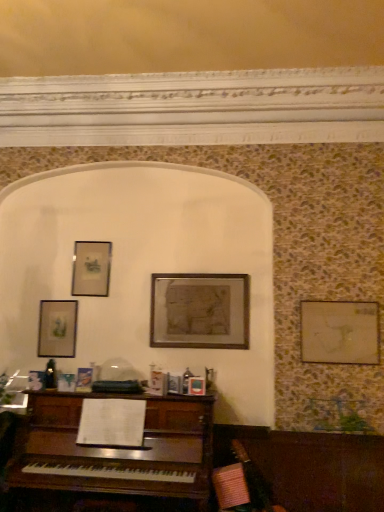
Image resolution: width=384 pixels, height=512 pixels. What do you see at coordinates (340, 332) in the screenshot? I see `wooden picture frame at right, which is counted as the 1th picture frame, starting from the right` at bounding box center [340, 332].

This screenshot has height=512, width=384. What do you see at coordinates (57, 328) in the screenshot? I see `matte glass picture frame at upper left, arranged as the 1th picture frame when viewed from the left` at bounding box center [57, 328].

Identify the location of wooden picture frame at right, which is the 4th picture frame from left to right. This screenshot has width=384, height=512. (340, 332).

Would you say matte glass picture frame at upper left, arranged as the 1th picture frame when viewed from the left, is a long distance from wooden framed map at center, which is counted as the 3th picture frame, starting from the left?

Actually, matte glass picture frame at upper left, arranged as the 1th picture frame when viewed from the left, and wooden framed map at center, which is counted as the 3th picture frame, starting from the left, are a little close together.

Find the location of a particular element. The height and width of the screenshot is (512, 384). picture frame that is the 2nd object to the left of the wooden framed map at center, the 2th picture frame from the right, starting at the anchor is located at coordinates (57, 328).

From the picture: Considering the sizes of objects matte glass picture frame at upper left, which ranks as the 4th picture frame in right-to-left order, and wooden framed map at center, which is counted as the 3th picture frame, starting from the left, in the image provided, who is wider, matte glass picture frame at upper left, which ranks as the 4th picture frame in right-to-left order, or wooden framed map at center, which is counted as the 3th picture frame, starting from the left,?

With larger width is wooden framed map at center, which is counted as the 3th picture frame, starting from the left.

Could you tell me if matte glass picture frame at upper left, arranged as the 1th picture frame when viewed from the left, is facing wooden framed map at center, which is counted as the 3th picture frame, starting from the left?

No, matte glass picture frame at upper left, arranged as the 1th picture frame when viewed from the left, is not turned towards wooden framed map at center, which is counted as the 3th picture frame, starting from the left.

Consider the image. Are wooden picture frame at right, which is the 4th picture frame from left to right, and matte glass picture frame at upper left, arranged as the 1th picture frame when viewed from the left, making contact?

No, wooden picture frame at right, which is the 4th picture frame from left to right, is not beside matte glass picture frame at upper left, arranged as the 1th picture frame when viewed from the left.

Is wooden picture frame at right, which is counted as the 1th picture frame, starting from the right, at the left side of matte glass picture frame at upper left, arranged as the 1th picture frame when viewed from the left?

Incorrect, wooden picture frame at right, which is counted as the 1th picture frame, starting from the right, is not on the left side of matte glass picture frame at upper left, arranged as the 1th picture frame when viewed from the left.

From the image's perspective, is wooden picture frame at right, which is counted as the 1th picture frame, starting from the right, over matte glass picture frame at upper left, which ranks as the 4th picture frame in right-to-left order?

Yes, from the image's perspective, wooden picture frame at right, which is counted as the 1th picture frame, starting from the right, is over matte glass picture frame at upper left, which ranks as the 4th picture frame in right-to-left order.

Considering the positions of objects wooden picture frame at right, which is counted as the 1th picture frame, starting from the right, and matte glass picture frame at upper left, which ranks as the 4th picture frame in right-to-left order, in the image provided, who is behind, wooden picture frame at right, which is counted as the 1th picture frame, starting from the right, or matte glass picture frame at upper left, which ranks as the 4th picture frame in right-to-left order,?

matte glass picture frame at upper left, which ranks as the 4th picture frame in right-to-left order, is more distant.

Does matte silver picture frame at upper left, placed as the third picture frame when sorted from right to left, have a greater height compared to wooden framed map at center, the 2th picture frame from the right?

No, matte silver picture frame at upper left, placed as the third picture frame when sorted from right to left, is not taller than wooden framed map at center, the 2th picture frame from the right.

Is matte silver picture frame at upper left, the second picture frame from the left, next to wooden framed map at center, the 2th picture frame from the right?

No.

Is matte silver picture frame at upper left, the second picture frame from the left, positioned beyond the bounds of wooden framed map at center, which is counted as the 3th picture frame, starting from the left?

That's correct, matte silver picture frame at upper left, the second picture frame from the left, is outside of wooden framed map at center, which is counted as the 3th picture frame, starting from the left.

Considering the relative sizes of wooden framed map at center, which is counted as the 3th picture frame, starting from the left, and wooden picture frame at right, which is counted as the 1th picture frame, starting from the right, in the image provided, is wooden framed map at center, which is counted as the 3th picture frame, starting from the left, shorter than wooden picture frame at right, which is counted as the 1th picture frame, starting from the right,?

No.

Is point (226, 325) behind point (335, 310)?

Yes, point (226, 325) is behind point (335, 310).

How distant is wooden framed map at center, which is counted as the 3th picture frame, starting from the left, from wooden picture frame at right, which is counted as the 1th picture frame, starting from the right?

The distance of wooden framed map at center, which is counted as the 3th picture frame, starting from the left, from wooden picture frame at right, which is counted as the 1th picture frame, starting from the right, is 30.80 inches.

From the picture: Is wooden framed map at center, the 2th picture frame from the right, to the left of wooden picture frame at right, which is counted as the 1th picture frame, starting from the right, from the viewer's perspective?

Indeed, wooden framed map at center, the 2th picture frame from the right, is positioned on the left side of wooden picture frame at right, which is counted as the 1th picture frame, starting from the right.

Is wooden framed map at center, which is counted as the 3th picture frame, starting from the left, positioned beyond the bounds of matte silver picture frame at upper left, placed as the third picture frame when sorted from right to left?

Yes.

The height and width of the screenshot is (512, 384). What are the coordinates of `the 1st picture frame to the left when counting from the wooden framed map at center, the 2th picture frame from the right` in the screenshot? It's located at (91, 268).

Considering the points (185, 338) and (80, 270), which point is in front, point (185, 338) or point (80, 270)?

Point (185, 338)

Visually, is wooden framed map at center, the 2th picture frame from the right, positioned to the left or to the right of matte silver picture frame at upper left, placed as the third picture frame when sorted from right to left?

From the image, it's evident that wooden framed map at center, the 2th picture frame from the right, is to the right of matte silver picture frame at upper left, placed as the third picture frame when sorted from right to left.

Can you tell me how much wooden framed map at center, the 2th picture frame from the right, and matte glass picture frame at upper left, arranged as the 1th picture frame when viewed from the left, differ in facing direction?

0.557 degrees.

From the image's perspective, is wooden framed map at center, which is counted as the 3th picture frame, starting from the left, on matte glass picture frame at upper left, which ranks as the 4th picture frame in right-to-left order?

Yes, from the image's perspective, wooden framed map at center, which is counted as the 3th picture frame, starting from the left, is over matte glass picture frame at upper left, which ranks as the 4th picture frame in right-to-left order.

Is wooden framed map at center, the 2th picture frame from the right, located outside matte glass picture frame at upper left, which ranks as the 4th picture frame in right-to-left order?

wooden framed map at center, the 2th picture frame from the right, is positioned outside matte glass picture frame at upper left, which ranks as the 4th picture frame in right-to-left order.

Is the position of wooden framed map at center, the 2th picture frame from the right, more distant than that of matte glass picture frame at upper left, which ranks as the 4th picture frame in right-to-left order?

That is False.

The width and height of the screenshot is (384, 512). I want to click on picture frame that is on the right side of wooden framed map at center, which is counted as the 3th picture frame, starting from the left, so click(340, 332).

Is wooden framed map at center, the 2th picture frame from the right, at the back of wooden picture frame at right, which is the 4th picture frame from left to right?

No, wooden picture frame at right, which is the 4th picture frame from left to right, is not facing the opposite direction of wooden framed map at center, the 2th picture frame from the right.

Between wooden picture frame at right, which is counted as the 1th picture frame, starting from the right, and wooden framed map at center, which is counted as the 3th picture frame, starting from the left, which one has smaller size?

With smaller size is wooden picture frame at right, which is counted as the 1th picture frame, starting from the right.

Considering the sizes of objects wooden picture frame at right, which is counted as the 1th picture frame, starting from the right, and wooden framed map at center, which is counted as the 3th picture frame, starting from the left, in the image provided, who is thinner, wooden picture frame at right, which is counted as the 1th picture frame, starting from the right, or wooden framed map at center, which is counted as the 3th picture frame, starting from the left,?

Thinner between the two is wooden picture frame at right, which is counted as the 1th picture frame, starting from the right.

From the image's perspective, count 2nd picture frames upward from the matte glass picture frame at upper left, which ranks as the 4th picture frame in right-to-left order, and point to it. Please provide its 2D coordinates.

[(200, 311)]

Image resolution: width=384 pixels, height=512 pixels. What are the coordinates of `picture frame that is the 3rd one when counting leftward from the wooden picture frame at right, which is the 4th picture frame from left to right` in the screenshot? It's located at (57, 328).

When comparing their distances from matte silver picture frame at upper left, the second picture frame from the left, does wooden picture frame at right, which is the 4th picture frame from left to right, or matte glass picture frame at upper left, arranged as the 1th picture frame when viewed from the left, seem closer?

matte glass picture frame at upper left, arranged as the 1th picture frame when viewed from the left, is positioned closer to the anchor matte silver picture frame at upper left, the second picture frame from the left.

Based on their spatial positions, is matte glass picture frame at upper left, which ranks as the 4th picture frame in right-to-left order, or wooden framed map at center, which is counted as the 3th picture frame, starting from the left, further from wooden picture frame at right, which is counted as the 1th picture frame, starting from the right?

matte glass picture frame at upper left, which ranks as the 4th picture frame in right-to-left order, is positioned further to the anchor wooden picture frame at right, which is counted as the 1th picture frame, starting from the right.

Based on their spatial positions, is wooden framed map at center, which is counted as the 3th picture frame, starting from the left, or wooden picture frame at right, which is the 4th picture frame from left to right, closer to matte glass picture frame at upper left, arranged as the 1th picture frame when viewed from the left?

wooden framed map at center, which is counted as the 3th picture frame, starting from the left, lies closer to matte glass picture frame at upper left, arranged as the 1th picture frame when viewed from the left, than the other object.

From the image, which object appears to be farther from wooden framed map at center, which is counted as the 3th picture frame, starting from the left, matte silver picture frame at upper left, the second picture frame from the left, or matte glass picture frame at upper left, arranged as the 1th picture frame when viewed from the left?

Based on the image, matte glass picture frame at upper left, arranged as the 1th picture frame when viewed from the left, appears to be further to wooden framed map at center, which is counted as the 3th picture frame, starting from the left.

Which object lies further to the anchor point wooden framed map at center, which is counted as the 3th picture frame, starting from the left, matte silver picture frame at upper left, the second picture frame from the left, or wooden picture frame at right, which is counted as the 1th picture frame, starting from the right?

wooden picture frame at right, which is counted as the 1th picture frame, starting from the right, is further to wooden framed map at center, which is counted as the 3th picture frame, starting from the left.

When comparing their distances from matte silver picture frame at upper left, the second picture frame from the left, does wooden picture frame at right, which is the 4th picture frame from left to right, or wooden framed map at center, the 2th picture frame from the right, seem further?

wooden picture frame at right, which is the 4th picture frame from left to right, is positioned further to the anchor matte silver picture frame at upper left, the second picture frame from the left.

Based on their spatial positions, is wooden framed map at center, the 2th picture frame from the right, or matte glass picture frame at upper left, which ranks as the 4th picture frame in right-to-left order, closer to matte silver picture frame at upper left, the second picture frame from the left?

matte glass picture frame at upper left, which ranks as the 4th picture frame in right-to-left order, lies closer to matte silver picture frame at upper left, the second picture frame from the left, than the other object.

Looking at this image, looking at the image, which one is located closer to matte glass picture frame at upper left, arranged as the 1th picture frame when viewed from the left, matte silver picture frame at upper left, the second picture frame from the left, or wooden picture frame at right, which is the 4th picture frame from left to right?

Based on the image, matte silver picture frame at upper left, the second picture frame from the left, appears to be nearer to matte glass picture frame at upper left, arranged as the 1th picture frame when viewed from the left.

Where is `picture frame located between matte silver picture frame at upper left, the second picture frame from the left, and wooden picture frame at right, which is the 4th picture frame from left to right, in the left-right direction`? The height and width of the screenshot is (512, 384). picture frame located between matte silver picture frame at upper left, the second picture frame from the left, and wooden picture frame at right, which is the 4th picture frame from left to right, in the left-right direction is located at coordinates (200, 311).

You are a GUI agent. You are given a task and a screenshot of the screen. Output one action in this format:
    pyautogui.click(x=<x>, y=<y>)
    Task: Click on the picture frame between matte glass picture frame at upper left, which ranks as the 4th picture frame in right-to-left order, and wooden framed map at center, which is counted as the 3th picture frame, starting from the left
    The height and width of the screenshot is (512, 384).
    Given the screenshot: What is the action you would take?
    coord(91,268)